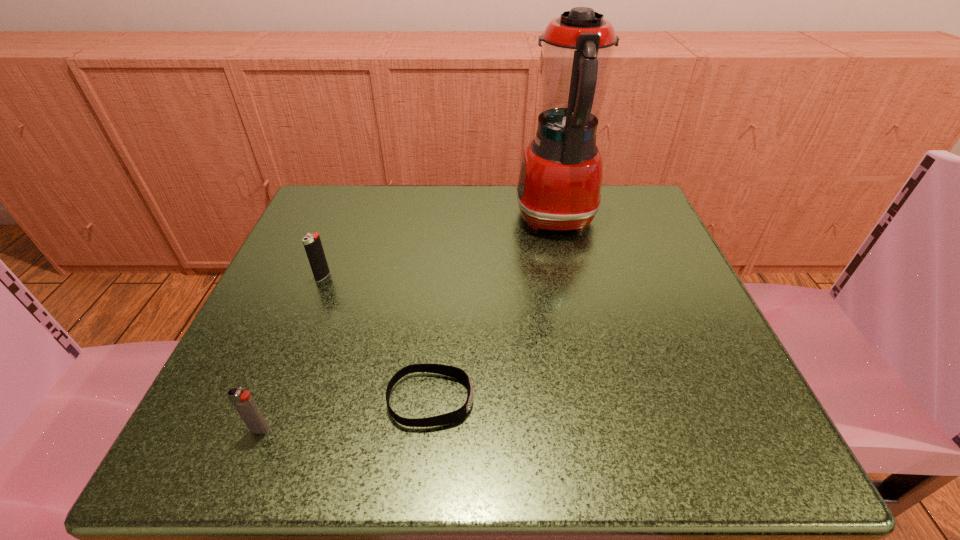
Image resolution: width=960 pixels, height=540 pixels. What are the coordinates of `free spot at the left edge of the desktop` in the screenshot? It's located at (338, 338).

In the image, there is a desktop. Identify the location of free space at the right edge. (693, 330).

This screenshot has height=540, width=960. Find the location of `free space at the far left corner of the desktop`. free space at the far left corner of the desktop is located at coordinates (333, 185).

I want to click on free space at the near left corner of the desktop, so click(255, 460).

Find the location of a particular element. This screenshot has width=960, height=540. vacant space at the far right corner is located at coordinates (599, 214).

Find the location of a particular element. vacant space in between the nearer igniter and the tallest object is located at coordinates (408, 324).

At what (x,y) coordinates should I click in order to perform the action: click on free space between the farther igniter and the wristband. Please return your answer as a coordinate pair (x, y). The image size is (960, 540). Looking at the image, I should click on (376, 338).

The width and height of the screenshot is (960, 540). What are the coordinates of `free space between the third object from left to right and the third nearest object` in the screenshot? It's located at (376, 338).

This screenshot has width=960, height=540. I want to click on vacant space in between the third nearest object and the wristband, so click(376, 338).

I want to click on empty space that is in between the farther igniter and the wristband, so click(376, 338).